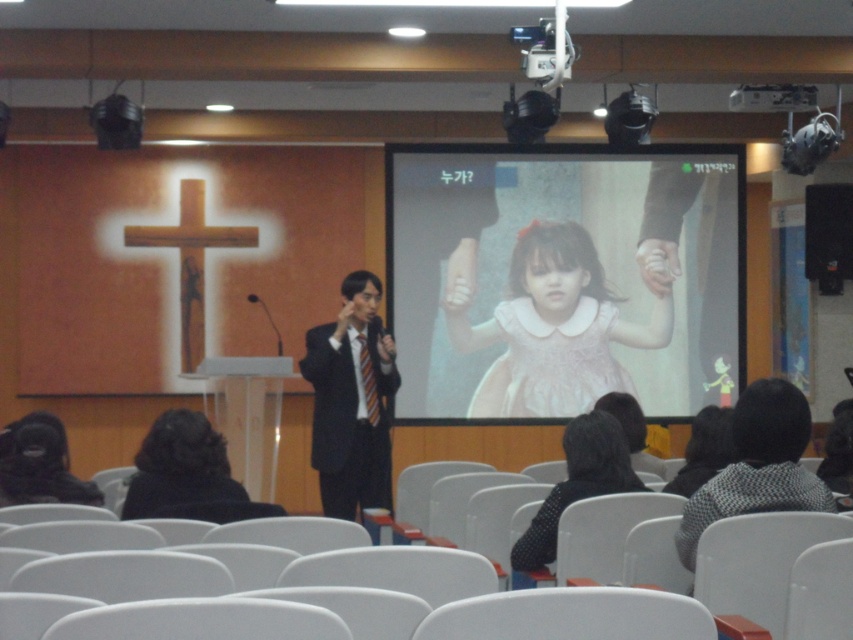
Consider the image. Between matte pink dress at center and black dotted blouse at lower center, which one is positioned higher?

matte pink dress at center

Does matte pink dress at center have a lesser height compared to black dotted blouse at lower center?

In fact, matte pink dress at center may be taller than black dotted blouse at lower center.

The image size is (853, 640). What are the coordinates of `matte pink dress at center` in the screenshot? It's located at (564, 278).

Image resolution: width=853 pixels, height=640 pixels. What are the coordinates of `matte pink dress at center` in the screenshot? It's located at click(x=564, y=278).

Consider the image. Can you confirm if pink satin dress at center is wider than metallic projector at upper center?

Correct, the width of pink satin dress at center exceeds that of metallic projector at upper center.

Can you confirm if pink satin dress at center is thinner than metallic projector at upper center?

No, pink satin dress at center is not thinner than metallic projector at upper center.

The image size is (853, 640). What do you see at coordinates (552, 328) in the screenshot?
I see `pink satin dress at center` at bounding box center [552, 328].

Image resolution: width=853 pixels, height=640 pixels. In order to click on pink satin dress at center in this screenshot , I will do `click(552, 328)`.

What do you see at coordinates (351, 401) in the screenshot? I see `black suit at center` at bounding box center [351, 401].

Does black suit at center have a lesser width compared to matte black suit at center?

In fact, black suit at center might be wider than matte black suit at center.

Which is behind, point (380, 493) or point (0, 122)?

Positioned behind is point (0, 122).

Locate an element on the screen. The image size is (853, 640). black suit at center is located at coordinates (351, 401).